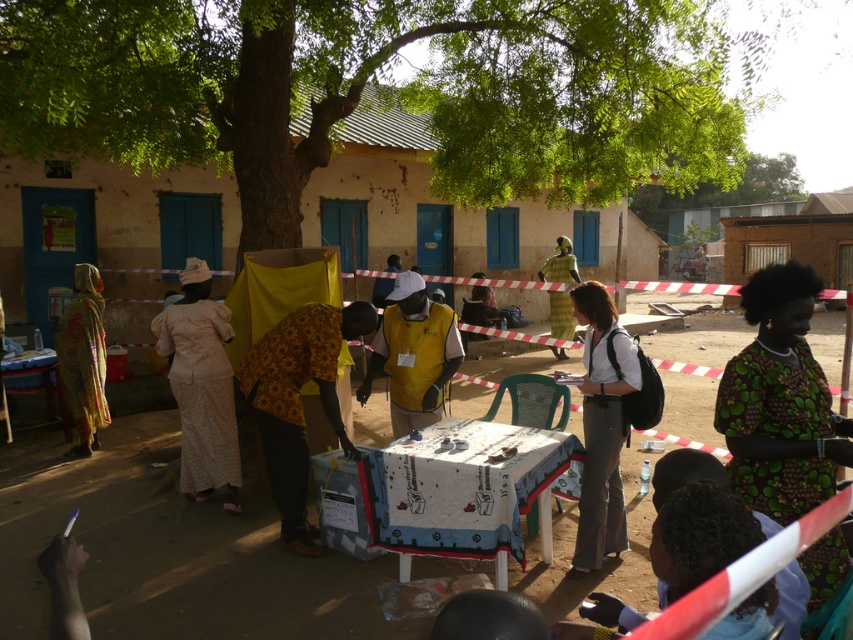
Question: Estimate the real-world distances between objects in this image. Which object is closer to the white fabric shirt at center?

Choices:
 (A) yellow printed fabric at left
 (B) green leafy tree at center
 (C) light pink fabric skirt at left

Answer: (C)

Question: Among these objects, which one is farthest from the camera?

Choices:
 (A) green leafy tree at center
 (B) yellow floral dress at center
 (C) white fabric shirt at center

Answer: (B)

Question: Based on their relative distances, which object is nearer to the light pink fabric skirt at left?

Choices:
 (A) yellow floral dress at center
 (B) yellow printed fabric at left

Answer: (A)

Question: Can you confirm if yellow floral dress at center is bigger than light pink fabric skirt at left?

Choices:
 (A) no
 (B) yes

Answer: (B)

Question: From the image, what is the correct spatial relationship of yellow floral dress at center in relation to yellow printed fabric at left?

Choices:
 (A) above
 (B) below

Answer: (B)

Question: Is green printed dress at center positioned in front of light pink fabric skirt at left?

Choices:
 (A) no
 (B) yes

Answer: (B)